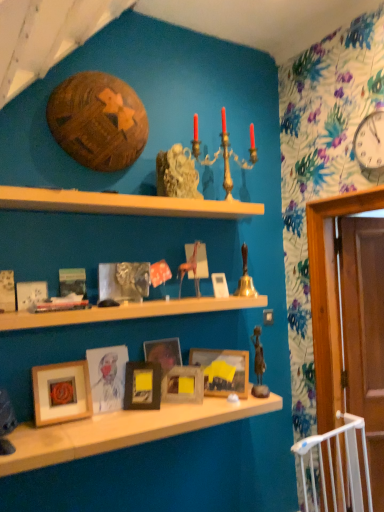
Where is `free point below wooden shelf at center, arranged as the second shelf when ordered from the bottom (from a real-world perspective)`? The width and height of the screenshot is (384, 512). free point below wooden shelf at center, arranged as the second shelf when ordered from the bottom (from a real-world perspective) is located at coordinates (110, 420).